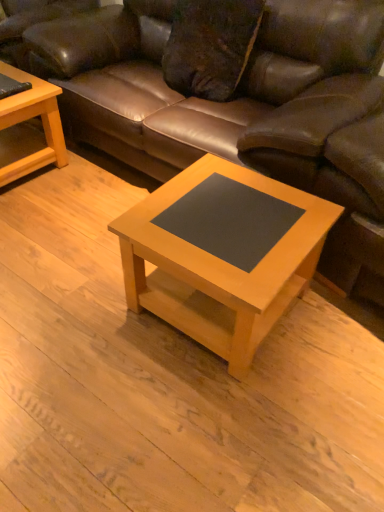
The height and width of the screenshot is (512, 384). What are the coordinates of `vacant space to the left of light wood/black laminate coffee table at center, which is counted as the second coffee table, starting from the back` in the screenshot? It's located at (75, 309).